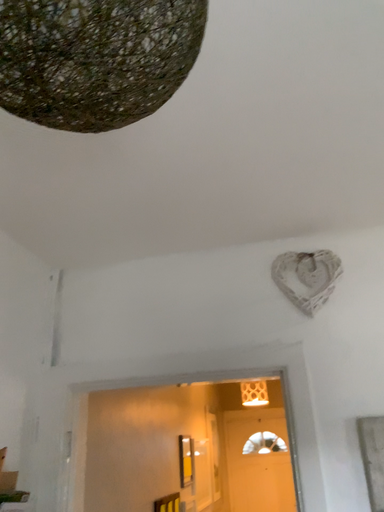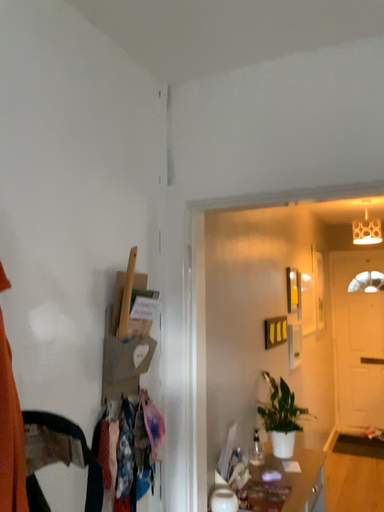
Question: How did the camera likely rotate when shooting the video?

Choices:
 (A) rotated upward
 (B) rotated downward

Answer: (B)